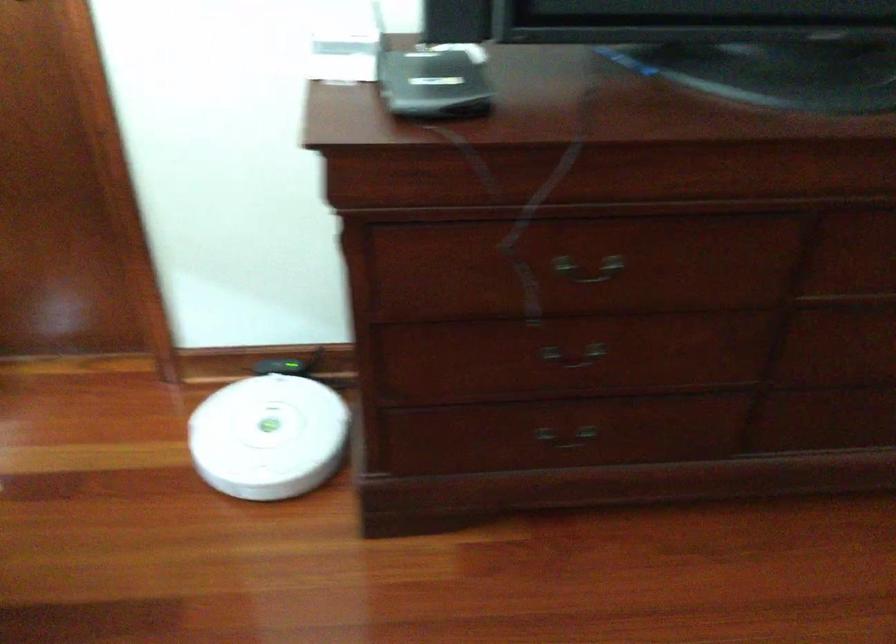
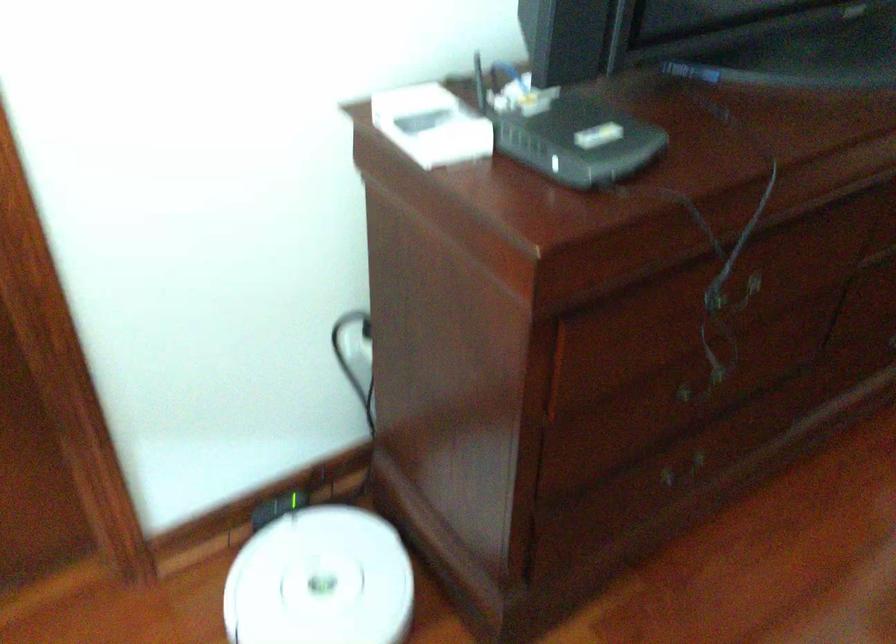
What movement of the cameraman would produce the second image?

The cameraman moved toward left, forward.